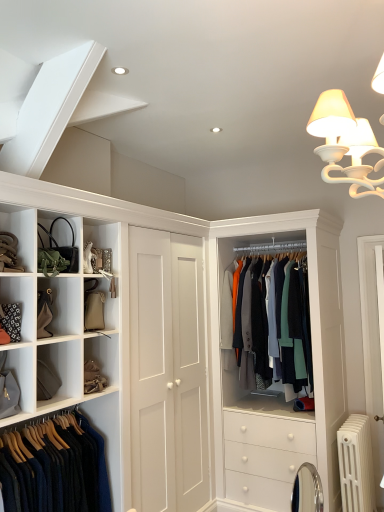
Question: Is textured wool coat at center, the 2th clothing positioned from the front, taller than matte gray bag at lower left?

Choices:
 (A) no
 (B) yes

Answer: (B)

Question: Could you tell me if textured wool coat at center, which is counted as the 2th clothing, starting from the left, is facing matte gray bag at lower left?

Choices:
 (A) yes
 (B) no

Answer: (A)

Question: Considering the relative sizes of textured wool coat at center, the 2th clothing positioned from the front, and matte gray bag at lower left in the image provided, is textured wool coat at center, the 2th clothing positioned from the front, bigger than matte gray bag at lower left?

Choices:
 (A) no
 (B) yes

Answer: (B)

Question: Can you confirm if textured wool coat at center, which ranks as the first clothing in back-to-front order, is smaller than matte gray bag at lower left?

Choices:
 (A) yes
 (B) no

Answer: (B)

Question: Does textured wool coat at center, which is counted as the 2th clothing, starting from the left, have a greater width compared to matte gray bag at lower left?

Choices:
 (A) no
 (B) yes

Answer: (B)

Question: Is textured wool coat at center, which is counted as the 2th clothing, starting from the left, not inside matte gray bag at lower left?

Choices:
 (A) no
 (B) yes

Answer: (B)

Question: Can you confirm if matte black handbag at upper left is bigger than tan leather belt at upper left?

Choices:
 (A) yes
 (B) no

Answer: (B)

Question: Is matte black handbag at upper left thinner than tan leather belt at upper left?

Choices:
 (A) no
 (B) yes

Answer: (A)

Question: From a real-world perspective, is matte black handbag at upper left physically below tan leather belt at upper left?

Choices:
 (A) no
 (B) yes

Answer: (A)

Question: From a real-world perspective, does matte black handbag at upper left stand above tan leather belt at upper left?

Choices:
 (A) yes
 (B) no

Answer: (A)

Question: Is matte black handbag at upper left completely or partially outside of tan leather belt at upper left?

Choices:
 (A) no
 (B) yes

Answer: (B)

Question: Is matte black handbag at upper left not near tan leather belt at upper left?

Choices:
 (A) yes
 (B) no

Answer: (B)

Question: Is matte gray bag at lower left not close to dark blue wool sweater at lower left, the second clothing positioned from the right?

Choices:
 (A) yes
 (B) no

Answer: (B)